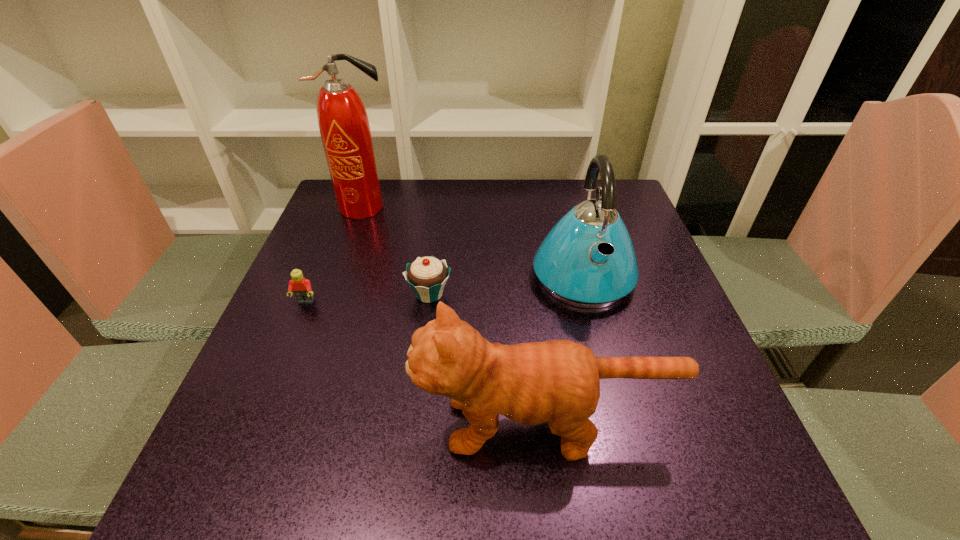
You are a GUI agent. You are given a task and a screenshot of the screen. Output one action in this format:
    pyautogui.click(x=<x>, y=<y>)
    Task: Click on the object present at the near right corner
    
    Given the screenshot: What is the action you would take?
    pyautogui.click(x=557, y=381)

Locate an element on the screen. The image size is (960, 540). free location at the far edge is located at coordinates (424, 197).

Identify the location of vacant space at the near edge of the desktop. (531, 505).

The width and height of the screenshot is (960, 540). What are the coordinates of `free location at the left edge of the desktop` in the screenshot? It's located at (256, 451).

Identify the location of vacant region at the right edge of the desktop. pos(612,306).

You are a GUI agent. You are given a task and a screenshot of the screen. Output one action in this format:
    pyautogui.click(x=<x>, y=<y>)
    Task: Click on the vacant area at the far left corner
    
    Given the screenshot: What is the action you would take?
    pyautogui.click(x=385, y=187)

Find the location of a particular element. The width and height of the screenshot is (960, 540). vacant space at the far right corner is located at coordinates (625, 218).

Find the location of a particular element. vacant area that lies between the cupcake and the Lego is located at coordinates (368, 298).

Where is `blank region between the shortest object and the fire extinguisher`? The height and width of the screenshot is (540, 960). blank region between the shortest object and the fire extinguisher is located at coordinates (335, 255).

Where is `vacant space that's between the Lego and the fourth tallest object`? This screenshot has height=540, width=960. vacant space that's between the Lego and the fourth tallest object is located at coordinates (368, 298).